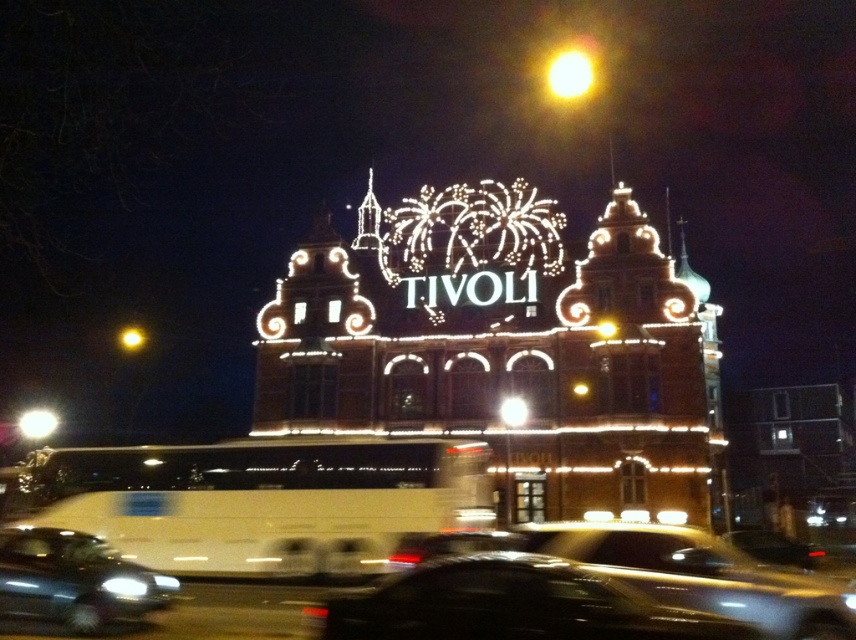
Does shiny black sedan at lower left have a lesser height compared to bright yellow light at upper center?

In fact, shiny black sedan at lower left may be taller than bright yellow light at upper center.

Which of these two, shiny black sedan at lower left or bright yellow light at upper center, stands shorter?

Standing shorter between the two is bright yellow light at upper center.

Is point (66, 580) farther from viewer compared to point (587, 84)?

No, (66, 580) is closer to viewer.

Where is `shiny black sedan at lower left`? Image resolution: width=856 pixels, height=640 pixels. shiny black sedan at lower left is located at coordinates (74, 580).

Who is more distant from viewer, [541,580] or [661,547]?

The point [661,547] is behind.

Is point (501, 616) positioned in front of point (711, 593)?

Yes, point (501, 616) is in front of point (711, 593).

Locate an element on the screen. This screenshot has width=856, height=640. black glossy car at lower center is located at coordinates (509, 605).

Does black glossy car at lower center come in front of bright yellow light at upper center?

That is True.

Image resolution: width=856 pixels, height=640 pixels. Find the location of `black glossy car at lower center`. black glossy car at lower center is located at coordinates (509, 605).